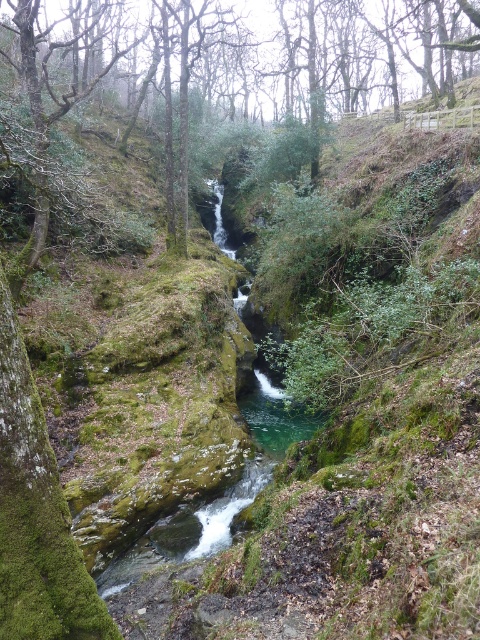
You are a hiker standing at the edge of the canyon. You see the green mossy rock at center and the clear water at center. How far apart are these two landmarks?

The green mossy rock at center and clear water at center are 93.52 feet apart.

You are standing at the edge of the canyon and want to cross to the other side. There is a green mossy rock at center and clear water at center. Which object should you step on first to start your crossing?

You should step on the green mossy rock at center first because it is closer to the viewer than the clear water at center, making it the first reachable object in the crossing path.